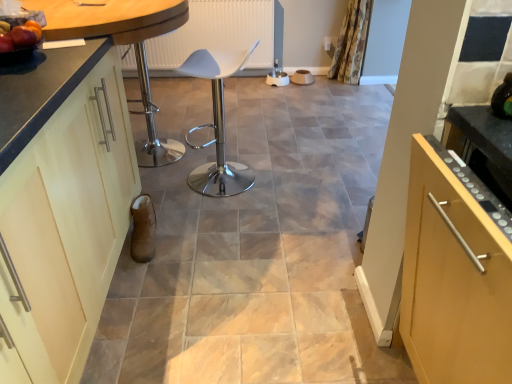
Describe the element at coordinates (150, 92) in the screenshot. This screenshot has height=384, width=512. I see `metallic silver bar stool at center` at that location.

What do you see at coordinates (217, 124) in the screenshot?
I see `white plastic chair at center` at bounding box center [217, 124].

What do you see at coordinates (351, 43) in the screenshot? I see `floral fabric curtain at upper right` at bounding box center [351, 43].

Where is `metallic silver bar stool at center`? metallic silver bar stool at center is located at coordinates (150, 92).

Does matte cream cabinet at left have a larger size compared to matte black countertop at left?

No.

Is point (116, 261) positioned before point (40, 90)?

No, (116, 261) is further to viewer.

Is matte cream cabinet at left not within matte black countertop at left?

Yes, matte cream cabinet at left is outside of matte black countertop at left.

Is matte cream cabinet at left inside or outside of metallic silver bar stool at center?

matte cream cabinet at left is not inside metallic silver bar stool at center, it's outside.

In the image, is matte cream cabinet at left positioned in front of or behind metallic silver bar stool at center?

matte cream cabinet at left is in front of metallic silver bar stool at center.

Is matte cream cabinet at left positioned with its back to metallic silver bar stool at center?

No, matte cream cabinet at left's orientation is not away from metallic silver bar stool at center.

This screenshot has height=384, width=512. What are the coordinates of `countertop above the floral fabric curtain at upper right (from a real-world perspective)` in the screenshot? It's located at (72, 61).

From a real-world perspective, which is physically below, floral fabric curtain at upper right or matte black countertop at left?

floral fabric curtain at upper right is physically lower.

Would you say floral fabric curtain at upper right contains matte black countertop at left?

No, floral fabric curtain at upper right does not contain matte black countertop at left.

Who is smaller, floral fabric curtain at upper right or matte black countertop at left?

floral fabric curtain at upper right is smaller.

From the image's perspective, which is above, matte black countertop at left or white plastic chair at center?

matte black countertop at left.

Does matte black countertop at left touch white plastic chair at center?

No, matte black countertop at left is not next to white plastic chair at center.

Can you confirm if matte black countertop at left is wider than white plastic chair at center?

Correct, the width of matte black countertop at left exceeds that of white plastic chair at center.

From their relative heights in the image, would you say matte black countertop at left is taller or shorter than white plastic chair at center?

In the image, matte black countertop at left appears to be taller than white plastic chair at center.

In the scene shown: Is floral fabric curtain at upper right in front of matte cream cabinet at left?

No, the depth of floral fabric curtain at upper right is greater than that of matte cream cabinet at left.

From a real-world perspective, is floral fabric curtain at upper right over matte cream cabinet at left?

Actually, floral fabric curtain at upper right is physically below matte cream cabinet at left in the real world.

Locate an element on the screen. This screenshot has width=512, height=384. curtain above the matte cream cabinet at left (from the image's perspective) is located at coordinates (351, 43).

Can matte cream cabinet at left be found inside floral fabric curtain at upper right?

No, matte cream cabinet at left is located outside of floral fabric curtain at upper right.

How many degrees apart are the facing directions of floral fabric curtain at upper right and metallic silver bar stool at center?

The facing directions of floral fabric curtain at upper right and metallic silver bar stool at center are 62.5 degrees apart.

Which is more to the right, floral fabric curtain at upper right or metallic silver bar stool at center?

floral fabric curtain at upper right.

Does point (352, 58) appear closer or farther from the camera than point (156, 156)?

Point (352, 58) appears to be farther away from the viewer than point (156, 156).

From the image's perspective, which one is positioned higher, floral fabric curtain at upper right or metallic silver bar stool at center?

floral fabric curtain at upper right appears higher in the image.

Considering the sizes of white plastic chair at center and metallic silver bar stool at center in the image, is white plastic chair at center bigger or smaller than metallic silver bar stool at center?

In the image, white plastic chair at center appears to be smaller than metallic silver bar stool at center.

Is point (204, 71) closer to viewer compared to point (131, 38)?

No, (204, 71) is further to viewer.

The height and width of the screenshot is (384, 512). There is a white plastic chair at center. In order to click on bar stool above it (from a real-world perspective) in this screenshot , I will do `click(150, 92)`.

Where is `countertop located above the matte cream cabinet at left (from the image's perspective)`? countertop located above the matte cream cabinet at left (from the image's perspective) is located at coordinates point(72,61).

The width and height of the screenshot is (512, 384). I want to click on cabinetry located in front of the metallic silver bar stool at center, so click(65, 229).

Based on the photo, based on their spatial positions, is matte cream cabinet at left or metallic silver bar stool at center further from floral fabric curtain at upper right?

The object further to floral fabric curtain at upper right is matte cream cabinet at left.

In the scene shown: Which object lies further to the anchor point metallic silver bar stool at center, floral fabric curtain at upper right or white plastic chair at center?

The object further to metallic silver bar stool at center is floral fabric curtain at upper right.

In the scene shown: Which object lies nearer to the anchor point floral fabric curtain at upper right, matte black countertop at left or metallic silver bar stool at center?

metallic silver bar stool at center is closer to floral fabric curtain at upper right.

Which object lies nearer to the anchor point matte cream cabinet at left, white plastic chair at center or matte black countertop at left?

matte black countertop at left.

Based on their spatial positions, is floral fabric curtain at upper right or matte cream cabinet at left further from metallic silver bar stool at center?

Based on the image, floral fabric curtain at upper right appears to be further to metallic silver bar stool at center.

When comparing their distances from matte cream cabinet at left, does matte black countertop at left or metallic silver bar stool at center seem further?

Among the two, metallic silver bar stool at center is located further to matte cream cabinet at left.

Considering their positions, is matte black countertop at left positioned closer to floral fabric curtain at upper right than white plastic chair at center?

white plastic chair at center lies closer to floral fabric curtain at upper right than the other object.

Looking at the image, which one is located further to matte cream cabinet at left, matte black countertop at left or white plastic chair at center?

Among the two, white plastic chair at center is located further to matte cream cabinet at left.

Find the location of a particular element. This screenshot has width=512, height=384. countertop positioned between matte cream cabinet at left and white plastic chair at center from near to far is located at coordinates (72, 61).

In order to click on bar stool between matte black countertop at left and floral fabric curtain at upper right from front to back in this screenshot , I will do `click(150, 92)`.

Find the location of a particular element. chair between matte cream cabinet at left and metallic silver bar stool at center along the z-axis is located at coordinates (217, 124).

Find the location of `chair located between matte cream cabinet at left and floral fabric curtain at upper right in the depth direction`. chair located between matte cream cabinet at left and floral fabric curtain at upper right in the depth direction is located at coordinates pyautogui.click(x=217, y=124).